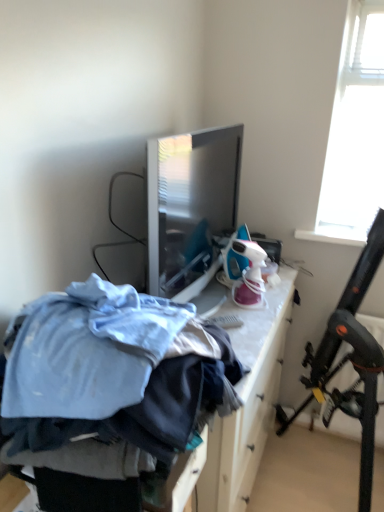
Question: From their relative heights in the image, would you say blue fabric pile at center is taller or shorter than black plastic folding chair at upper right?

Choices:
 (A) short
 (B) tall

Answer: (A)

Question: In the image, is blue fabric pile at center on the left side or the right side of black plastic folding chair at upper right?

Choices:
 (A) right
 (B) left

Answer: (B)

Question: Looking at the image, does blue fabric pile at center seem bigger or smaller compared to black plastic folding chair at upper right?

Choices:
 (A) big
 (B) small

Answer: (B)

Question: Choose the correct answer: Is black plastic folding chair at upper right inside blue fabric pile at center or outside it?

Choices:
 (A) outside
 (B) inside

Answer: (A)

Question: Is black plastic folding chair at upper right wider or thinner than blue fabric pile at center?

Choices:
 (A) wide
 (B) thin

Answer: (A)

Question: Considering the positions of black plastic folding chair at upper right and blue fabric pile at center in the image, is black plastic folding chair at upper right taller or shorter than blue fabric pile at center?

Choices:
 (A) tall
 (B) short

Answer: (A)

Question: From a real-world perspective, is black plastic folding chair at upper right physically located above or below blue fabric pile at center?

Choices:
 (A) below
 (B) above

Answer: (A)